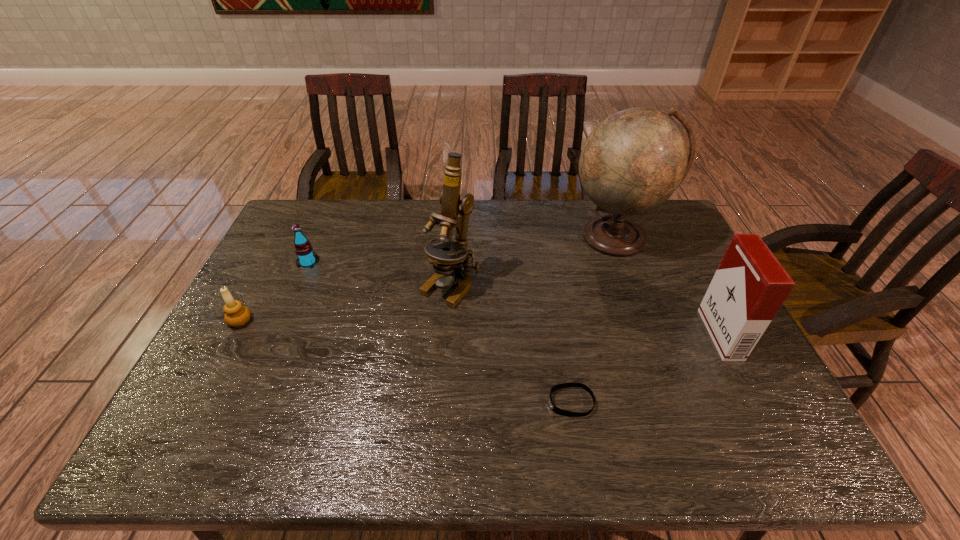
The image size is (960, 540). I want to click on vacant point located between the cigarette_case and the shortest object, so click(x=645, y=368).

What are the coordinates of `vacant space that's between the microscope and the fifth object from right to left` in the screenshot? It's located at (379, 274).

What are the coordinates of `unoccupied position between the fourth shortest object and the candle_holder` in the screenshot? It's located at (480, 327).

Where is `free space between the wristband and the second object from left to right`? This screenshot has height=540, width=960. free space between the wristband and the second object from left to right is located at coordinates coord(440,333).

Locate an element on the screen. The height and width of the screenshot is (540, 960). free spot between the wristband and the third object from left to right is located at coordinates (511, 344).

This screenshot has height=540, width=960. I want to click on free point between the nearest object and the fourth object from right to left, so click(511, 344).

You are a GUI agent. You are given a task and a screenshot of the screen. Output one action in this format:
    pyautogui.click(x=<x>, y=<y>)
    Task: Click on the blank region between the cigarette_case and the third object from right to left
    This screenshot has width=960, height=540.
    Given the screenshot: What is the action you would take?
    pyautogui.click(x=645, y=368)

Locate an element on the screen. The image size is (960, 540). empty space that is in between the second object from left to right and the nearest object is located at coordinates (440, 333).

I want to click on vacant area that lies between the soda and the fourth object from left to right, so click(440, 333).

Identify which object is the fifth closest to the wristband. Please provide its 2D coordinates. Your answer should be formatted as a tuple, i.e. [(x, y)], where the tuple contains the x and y coordinates of a point satisfying the conditions above.

[(236, 314)]